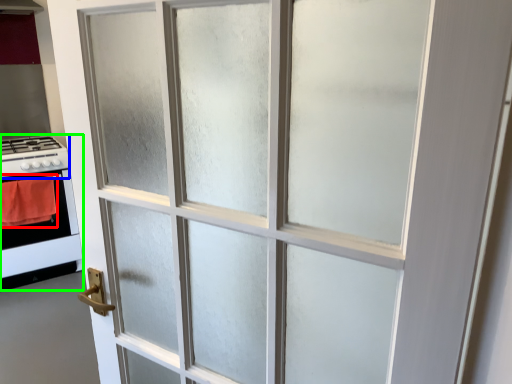
Question: Which object is the closest to the blanket (highlighted by a red box)? Choose among these: gas stove (highlighted by a blue box) or appliance (highlighted by a green box).

Choices:
 (A) gas stove
 (B) appliance

Answer: (B)